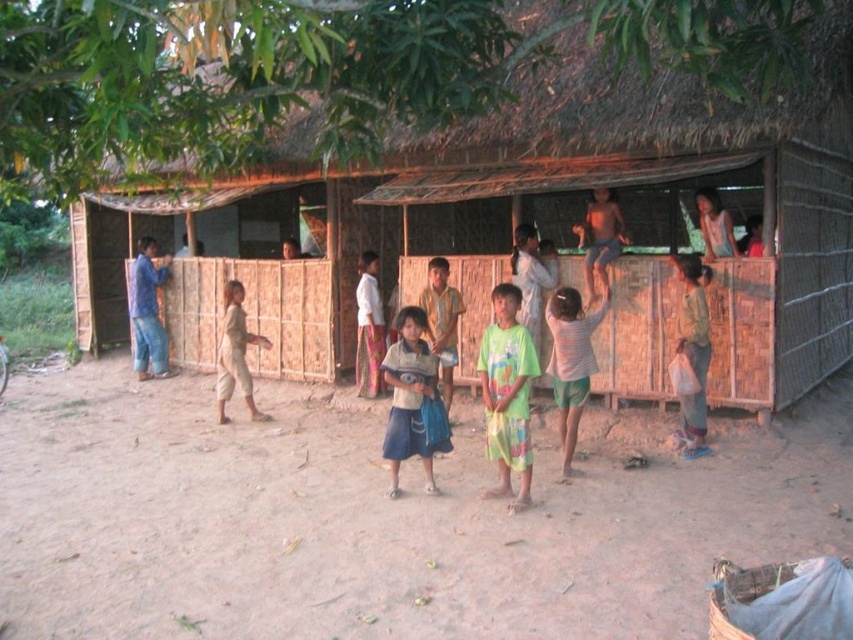
Between point (550, 340) and point (701, 340), which one is positioned in front?

Point (701, 340) is in front.

Does point (553, 292) come closer to viewer compared to point (677, 339)?

That is False.

Find the location of a particular element. striped fabric shirt at center is located at coordinates tap(570, 362).

Between blue denim shorts at center and light brown cotton pants at lower left, which one is positioned higher?

Positioned higher is light brown cotton pants at lower left.

Image resolution: width=853 pixels, height=640 pixels. Describe the element at coordinates (410, 397) in the screenshot. I see `blue denim shorts at center` at that location.

Measure the distance between point (x=428, y=486) and camera.

They are 20.69 feet apart.

Locate an element on the screen. Image resolution: width=853 pixels, height=640 pixels. blue denim shorts at center is located at coordinates (410, 397).

Does brown sandy ground at center have a greater height compared to green cotton shirt at center?

No, brown sandy ground at center is not taller than green cotton shirt at center.

Can you confirm if brown sandy ground at center is positioned above green cotton shirt at center?

No.

Between point (358, 444) and point (503, 449), which one is positioned in front?

Positioned in front is point (503, 449).

Where is `brown sandy ground at center`? This screenshot has width=853, height=640. brown sandy ground at center is located at coordinates (379, 520).